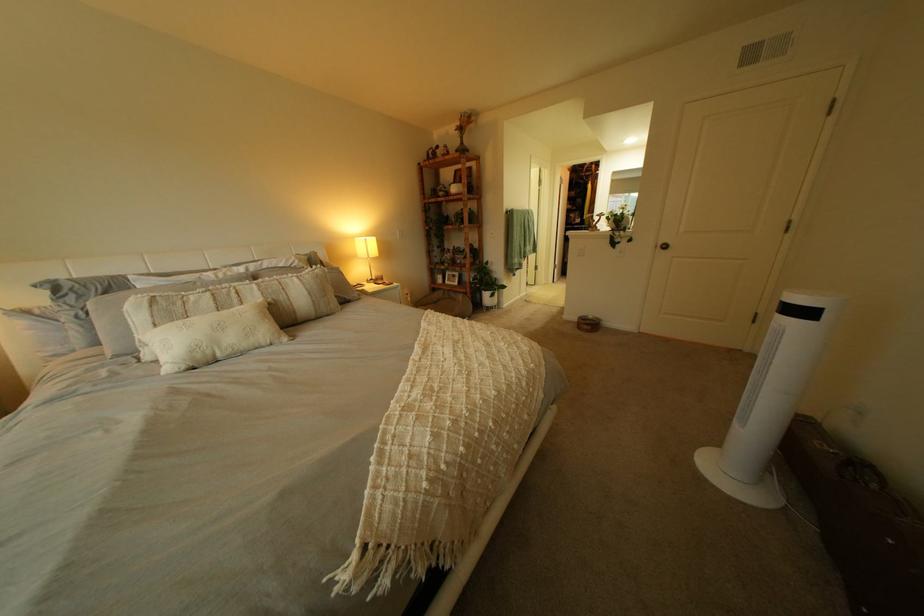
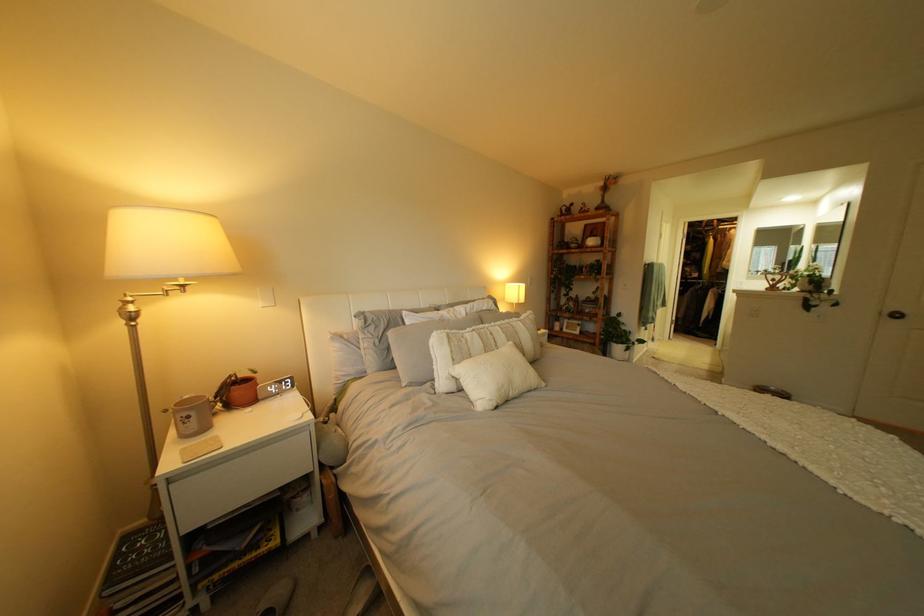
Find the pixel in the second image that matches (203,318) in the first image.

(485, 355)